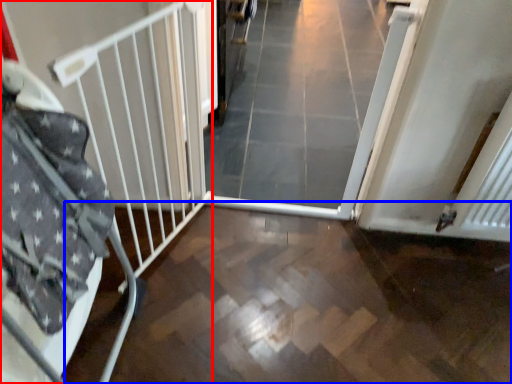
Question: Which point is closer to the camera, bed frame (highlighted by a red box) or path (highlighted by a blue box)?

Choices:
 (A) bed frame
 (B) path

Answer: (A)